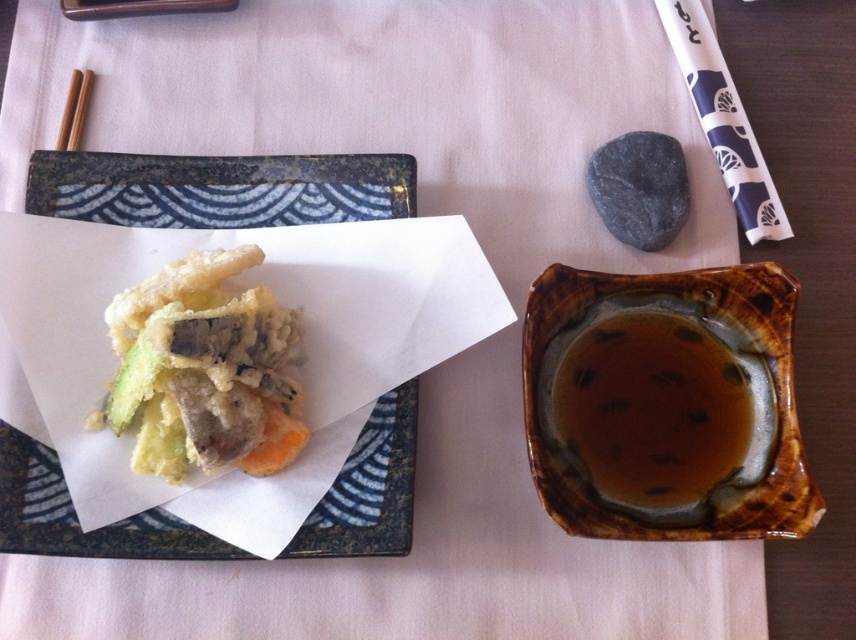
You are looking at the table setup and want to reach for the point at coordinates (559, 504). Considering your arm can comfortably extend 18 inches, will you be able to comfortably reach that point?

The point at coordinates (559, 504) is 19.11 inches away from the viewer, which is slightly beyond the comfortable arm extension of 18 inches. Therefore, you might need to lean forward or adjust your position to reach it comfortably.

You are a food photographer and need to adjust the lighting so that the brown glazed bowl at upper right is in focus while keeping the rectangular plate with dark blue and white waves in the background. Given the depth of field, what should you do?

Since the brown glazed bowl at upper right is closer to the camera at 18.29 inches, you should focus on it and adjust the aperture to ensure it remains sharp while the rectangular plate with dark blue and white waves in the background becomes slightly blurred.